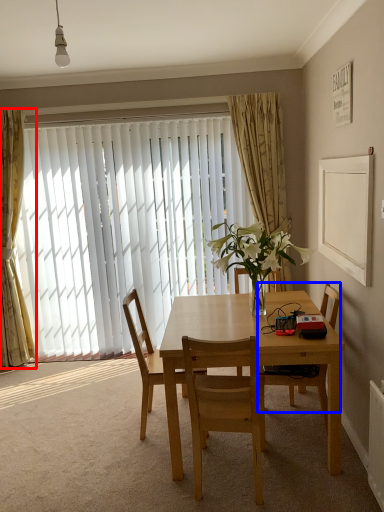
Question: Which object appears closest to the camera in this image, curtain (highlighted by a red box) or chair (highlighted by a blue box)?

Choices:
 (A) curtain
 (B) chair

Answer: (B)